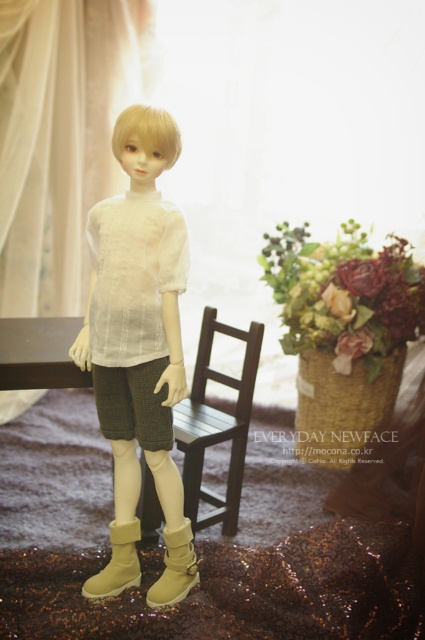
You are a photographer setting up a shoot in the room. You need to position a small stool between the wooden chair at center and the beige suede boot at lower center. Which object should the stool be placed closer to in order to maintain the existing spatial relationship?

The stool should be placed closer to the beige suede boot at lower center because the wooden chair at center is above it, so placing the stool closer to the boot maintains the vertical relationship between the objects.

You are organizing a small event and need to place the matte white shirt at center and the woven straw basket at center on a table. According to the image, which item should be placed to the left of the other?

The matte white shirt at center should be placed to the left of the woven straw basket at center because the description states that the matte white shirt at center is positioned on the left side of the woven straw basket at center.

You are a fashion designer observing a doll wearing a matte white shirt at center and beige suede boot at lower center. Which item is positioned higher on the doll?

The matte white shirt at center is positioned higher on the doll than the beige suede boot at lower center because it is located above it.